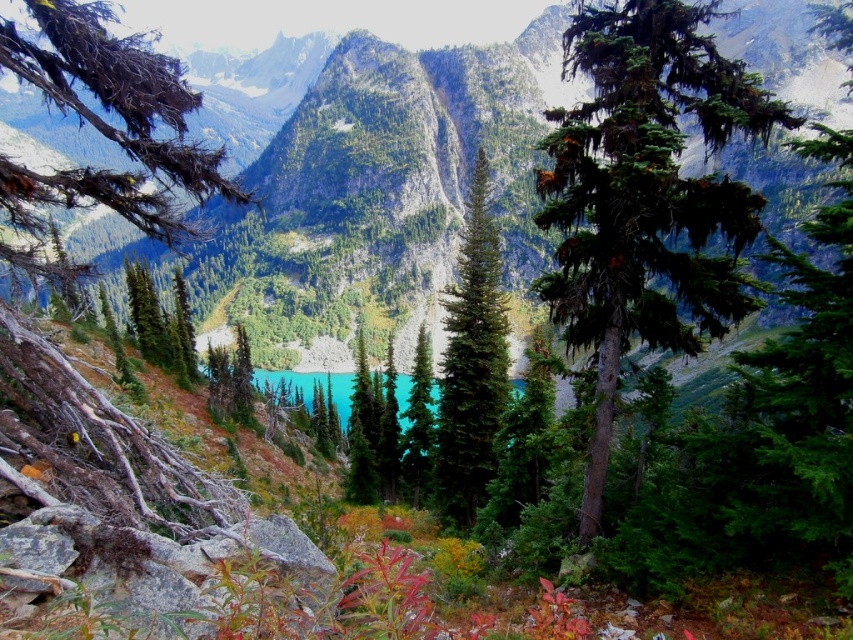
Question: Can you confirm if green matte tree at center is bigger than brown textured branch at upper left?

Choices:
 (A) no
 (B) yes

Answer: (A)

Question: Is green textured mountain at center behind green glossy tree at center?

Choices:
 (A) no
 (B) yes

Answer: (B)

Question: Among these points, which one is farthest from the camera?

Choices:
 (A) (425, 408)
 (B) (146, 166)
 (C) (381, 173)

Answer: (C)

Question: Which of the following is the closest to the observer?

Choices:
 (A) (160, 157)
 (B) (424, 381)
 (C) (657, 129)
 (D) (289, 204)

Answer: (C)

Question: Which point is farther from the camera taking this photo?

Choices:
 (A) (405, 106)
 (B) (450, 460)

Answer: (A)

Question: Does brown textured branch at upper left have a greater width compared to green glossy tree at center?

Choices:
 (A) no
 (B) yes

Answer: (B)